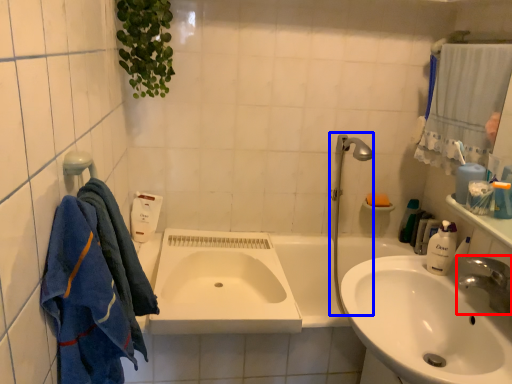
Question: Which object appears closest to the camera in this image, tap (highlighted by a red box) or plumbing fixture (highlighted by a blue box)?

Choices:
 (A) tap
 (B) plumbing fixture

Answer: (A)